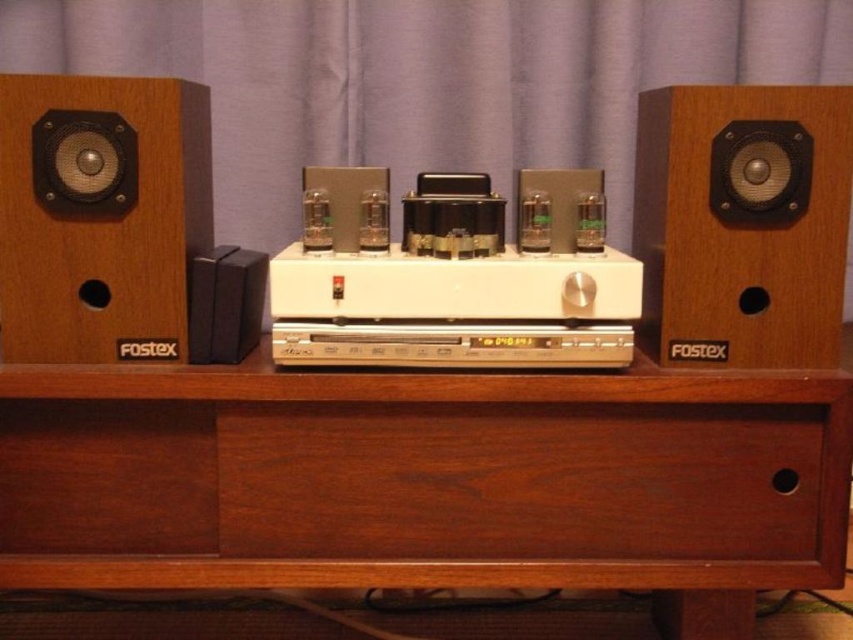
Question: Is brown wood drawer at center smaller than black matte speaker at center?

Choices:
 (A) yes
 (B) no

Answer: (B)

Question: Which of these objects is positioned closest to the brown wood drawer at center?

Choices:
 (A) purple fabric curtain at upper center
 (B) brown wood table at center
 (C) black matte speaker at center
 (D) wooden speaker at left

Answer: (B)

Question: Which point is farther from the camera taking this photo?

Choices:
 (A) click(407, 419)
 (B) click(816, 502)
 (C) click(442, 125)
 (D) click(215, 298)

Answer: (C)

Question: Among these objects, which one is nearest to the camera?

Choices:
 (A) wooden speaker at center
 (B) black matte speaker at center
 (C) white plastic stereo at center

Answer: (A)

Question: Does brown wood drawer at center lie in front of white plastic stereo at center?

Choices:
 (A) yes
 (B) no

Answer: (B)

Question: Does brown wood drawer at center have a greater width compared to wooden speaker at left?

Choices:
 (A) no
 (B) yes

Answer: (B)